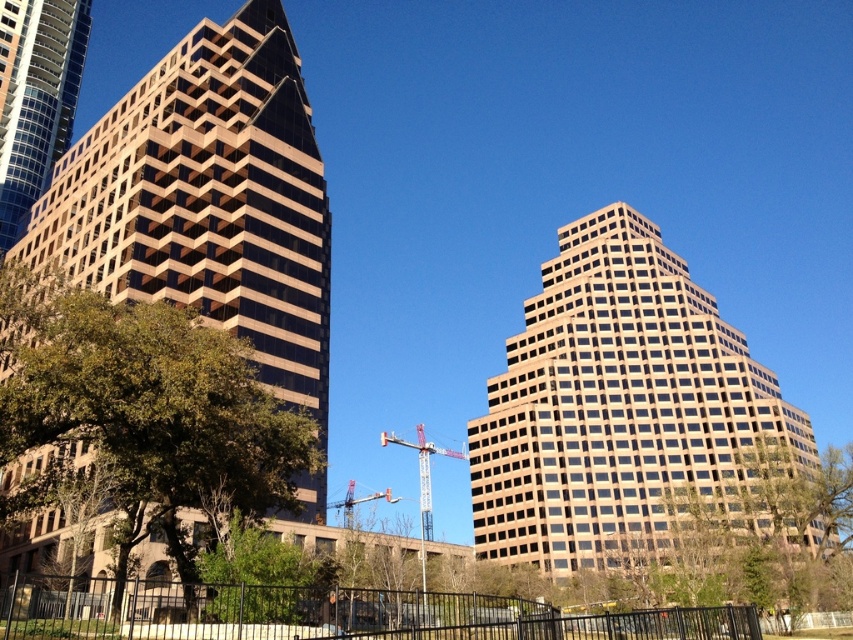
Is beige glass skyscraper at left further to the viewer compared to metallic red crane at center?

No.

Can you confirm if beige glass skyscraper at left is taller than metallic red crane at center?

Indeed, beige glass skyscraper at left has a greater height compared to metallic red crane at center.

What do you see at coordinates (35, 99) in the screenshot?
I see `beige glass skyscraper at left` at bounding box center [35, 99].

At what (x,y) coordinates should I click in order to perform the action: click on beige glass skyscraper at left. Please return your answer as a coordinate pair (x, y). The height and width of the screenshot is (640, 853). Looking at the image, I should click on (35, 99).

Does beige glass building at center have a greater height compared to metallic red crane at center?

Yes, beige glass building at center is taller than metallic red crane at center.

Which is more to the right, beige glass building at center or metallic red crane at center?

Positioned to the right is beige glass building at center.

I want to click on beige glass building at center, so click(624, 410).

I want to click on beige glass building at center, so click(624, 410).

Between matte tan building at center and metallic silver crane at center, which one is positioned lower?

Positioned lower is metallic silver crane at center.

Is matte tan building at center above metallic silver crane at center?

Correct, matte tan building at center is located above metallic silver crane at center.

Is point (258, 156) less distant than point (457, 458)?

Yes, point (258, 156) is closer to viewer.

Where is `matte tan building at center`? matte tan building at center is located at coordinates (207, 198).